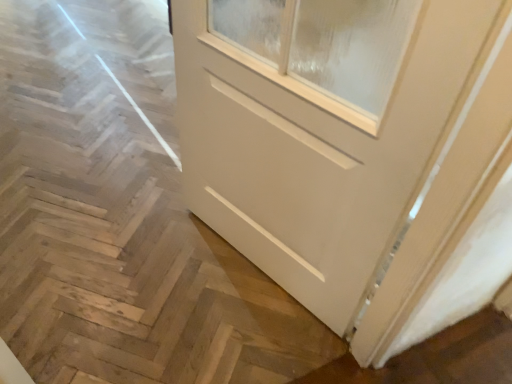
Locate an element on the screen. free space to the left of white matte door at center is located at coordinates (112, 281).